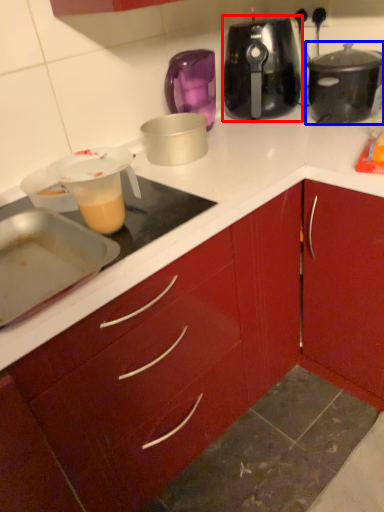
Question: Which object appears farthest to the camera in this image, slow cooker (highlighted by a red box) or slow cooker (highlighted by a blue box)?

Choices:
 (A) slow cooker
 (B) slow cooker

Answer: (A)